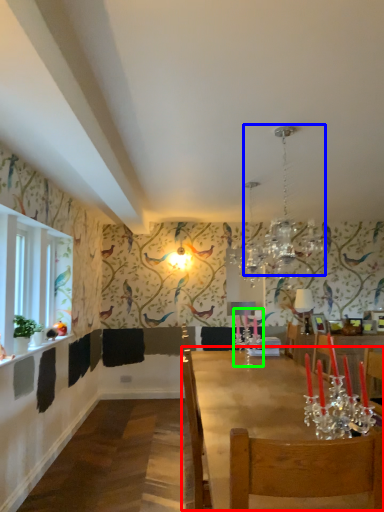
Question: Which object is the closest to the table (highlighted by a red box)? Choose among these: light fixture (highlighted by a blue box) or candle holder (highlighted by a green box).

Choices:
 (A) light fixture
 (B) candle holder

Answer: (B)